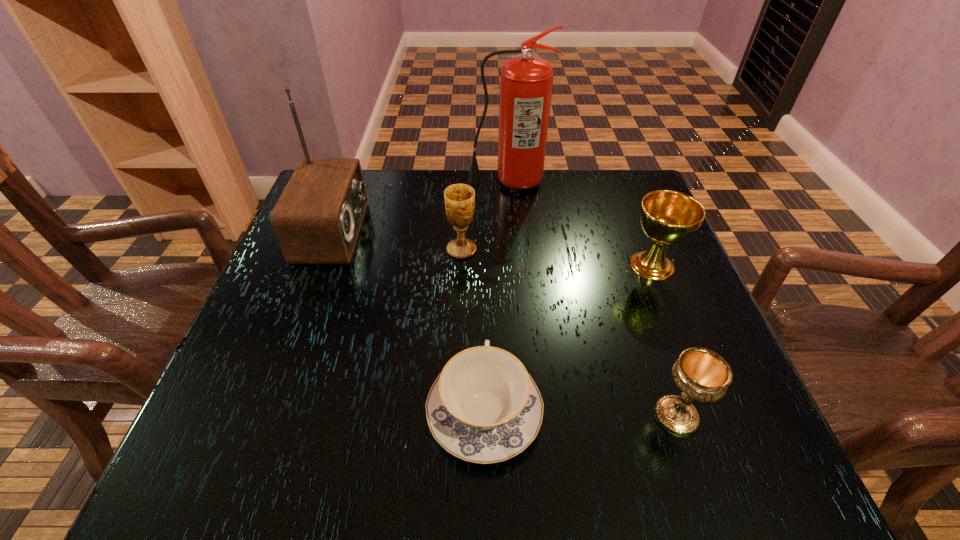
The width and height of the screenshot is (960, 540). Find the location of `free space located 0.170m on the left of the nearest chalice`. free space located 0.170m on the left of the nearest chalice is located at coordinates (547, 416).

Image resolution: width=960 pixels, height=540 pixels. In order to click on vacant space located 0.170m with the handle on the side of the chinaware in this screenshot , I will do `click(484, 293)`.

Find the location of a particular element. The height and width of the screenshot is (540, 960). free location located with the handle on the side of the chinaware is located at coordinates (483, 255).

Find the location of a particular element. vacant space located with the handle on the side of the chinaware is located at coordinates (483, 238).

Where is `fire extinguisher that is positioned at the far edge`? This screenshot has width=960, height=540. fire extinguisher that is positioned at the far edge is located at coordinates (526, 83).

In order to click on radio receiver located in the far edge section of the desktop in this screenshot , I will do `click(317, 219)`.

Where is `chalice present at the near edge`? The height and width of the screenshot is (540, 960). chalice present at the near edge is located at coordinates (701, 374).

Locate an element on the screen. The width and height of the screenshot is (960, 540). chinaware located in the near edge section of the desktop is located at coordinates (484, 407).

You are a GUI agent. You are given a task and a screenshot of the screen. Output one action in this format:
    pyautogui.click(x=<x>, y=<y>)
    Task: Click on the object that is at the left edge
    The width and height of the screenshot is (960, 540).
    Given the screenshot: What is the action you would take?
    click(x=317, y=219)

You are a GUI agent. You are given a task and a screenshot of the screen. Output one action in this format:
    pyautogui.click(x=<x>, y=<y>)
    Task: Click on the object that is at the far left corner
    The image size is (960, 540).
    Given the screenshot: What is the action you would take?
    point(317,219)